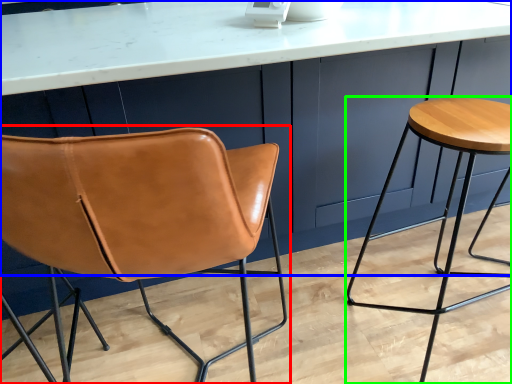
Question: Estimate the real-world distances between objects in this image. Which object is farther from chair (highlighted by a red box), counter (highlighted by a blue box) or stool (highlighted by a green box)?

Choices:
 (A) counter
 (B) stool

Answer: (B)